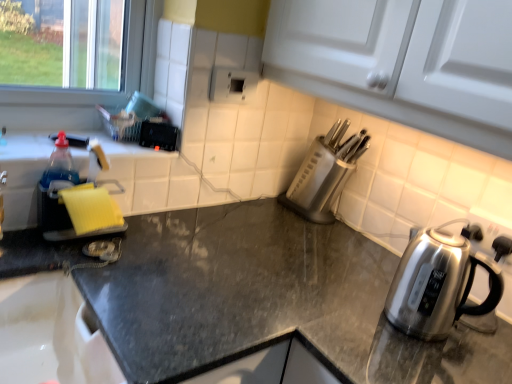
Question: Is satin silver kettle at right not within black granite countertop at center?

Choices:
 (A) no
 (B) yes

Answer: (B)

Question: From the image's perspective, does satin silver kettle at right appear lower than black granite countertop at center?

Choices:
 (A) yes
 (B) no

Answer: (B)

Question: Is satin silver kettle at right bigger than black granite countertop at center?

Choices:
 (A) yes
 (B) no

Answer: (B)

Question: Is satin silver kettle at right oriented away from black granite countertop at center?

Choices:
 (A) no
 (B) yes

Answer: (A)

Question: Can you confirm if satin silver kettle at right is taller than black granite countertop at center?

Choices:
 (A) no
 (B) yes

Answer: (A)

Question: From the image's perspective, relative to black granite countertop at center, is yellow sponge at left above or below?

Choices:
 (A) above
 (B) below

Answer: (A)

Question: Considering their positions, is yellow sponge at left located in front of or behind black granite countertop at center?

Choices:
 (A) behind
 (B) front

Answer: (A)

Question: Considering the positions of yellow sponge at left and black granite countertop at center in the image, is yellow sponge at left taller or shorter than black granite countertop at center?

Choices:
 (A) tall
 (B) short

Answer: (B)

Question: Is yellow sponge at left situated inside black granite countertop at center or outside?

Choices:
 (A) outside
 (B) inside

Answer: (A)

Question: Visually, is yellow sponge at left positioned to the left or to the right of satin silver knife block at center-right?

Choices:
 (A) left
 (B) right

Answer: (A)

Question: From the image's perspective, is yellow sponge at left positioned above or below satin silver knife block at center-right?

Choices:
 (A) above
 (B) below

Answer: (B)

Question: From their relative heights in the image, would you say yellow sponge at left is taller or shorter than satin silver knife block at center-right?

Choices:
 (A) tall
 (B) short

Answer: (B)

Question: In the image, is yellow sponge at left positioned in front of or behind satin silver knife block at center-right?

Choices:
 (A) behind
 (B) front

Answer: (B)

Question: From their relative heights in the image, would you say satin silver kettle at right is taller or shorter than yellow sponge at left?

Choices:
 (A) tall
 (B) short

Answer: (B)

Question: Considering the relative positions of satin silver kettle at right and yellow sponge at left in the image provided, is satin silver kettle at right to the left or to the right of yellow sponge at left?

Choices:
 (A) left
 (B) right

Answer: (B)